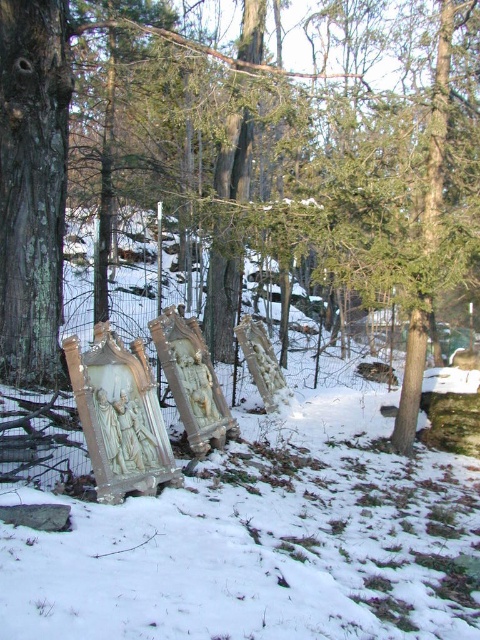
Question: Can you confirm if brown rough tree trunk at left is thinner than white matte snow at center?

Choices:
 (A) yes
 (B) no

Answer: (B)

Question: Where is brown rough tree trunk at left located in relation to white matte snow at center in the image?

Choices:
 (A) left
 (B) right

Answer: (B)

Question: Which object appears closest to the camera in this image?

Choices:
 (A) white matte snow at center
 (B) brown rough tree trunk at left

Answer: (A)

Question: Does brown rough tree trunk at left appear over white matte snow at center?

Choices:
 (A) no
 (B) yes

Answer: (B)